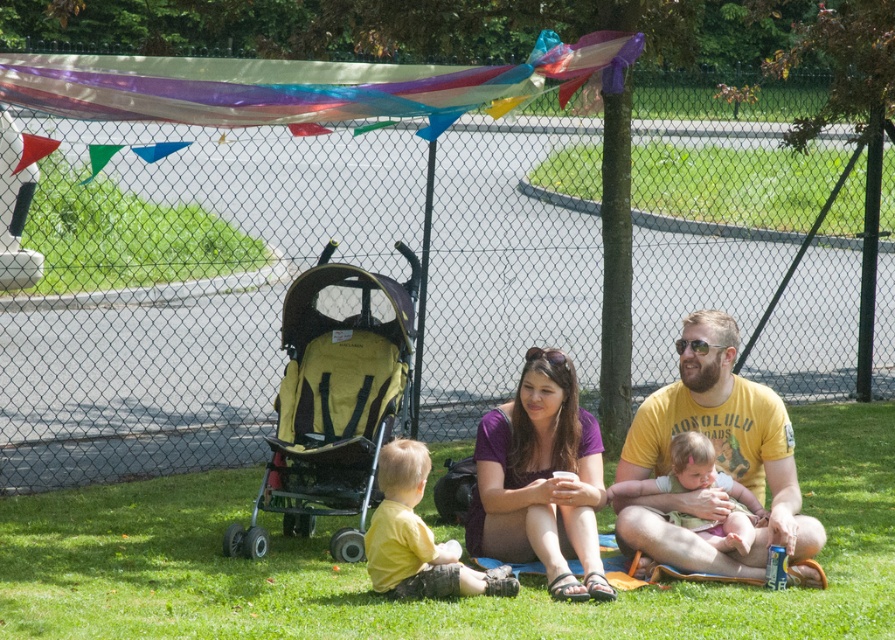
Question: Can you confirm if yellow cotton t-shirt at center is positioned above soft pink fabric at center?

Choices:
 (A) no
 (B) yes

Answer: (B)

Question: Can you confirm if yellow fabric stroller at left is positioned to the right of purple fabric at center?

Choices:
 (A) yes
 (B) no

Answer: (B)

Question: Among these points, which one is farthest from the camera?

Choices:
 (A) (529, 442)
 (B) (401, 372)
 (C) (524, 636)
 (D) (798, 509)

Answer: (B)

Question: Estimate the real-world distances between objects in this image. Which object is farther from the yellow matte shirt at lower center?

Choices:
 (A) green grass at center
 (B) purple fabric at center
 (C) yellow fabric stroller at left

Answer: (C)

Question: Estimate the real-world distances between objects in this image. Which object is farther from the soft pink fabric at center?

Choices:
 (A) yellow cotton t-shirt at center
 (B) purple fabric at center
 (C) yellow fabric stroller at left
 (D) green grass at center

Answer: (D)

Question: Does yellow fabric stroller at left have a larger size compared to yellow matte shirt at lower center?

Choices:
 (A) no
 (B) yes

Answer: (B)